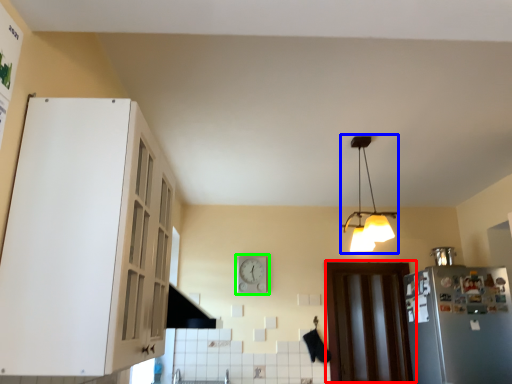
Question: Estimate the real-world distances between objects in this image. Which object is closer to door (highlighted by a red box), lamp (highlighted by a blue box) or clock (highlighted by a green box)?

Choices:
 (A) lamp
 (B) clock

Answer: (B)